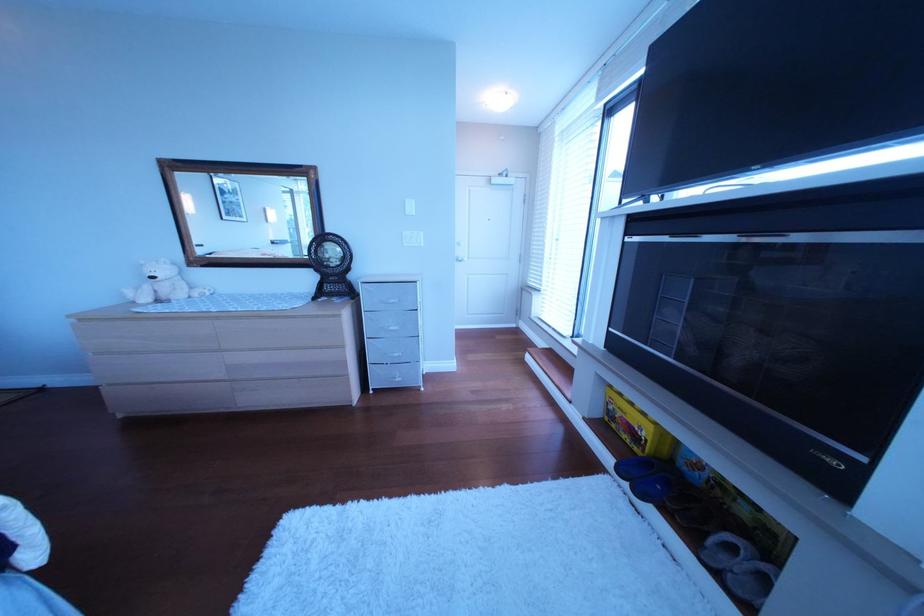
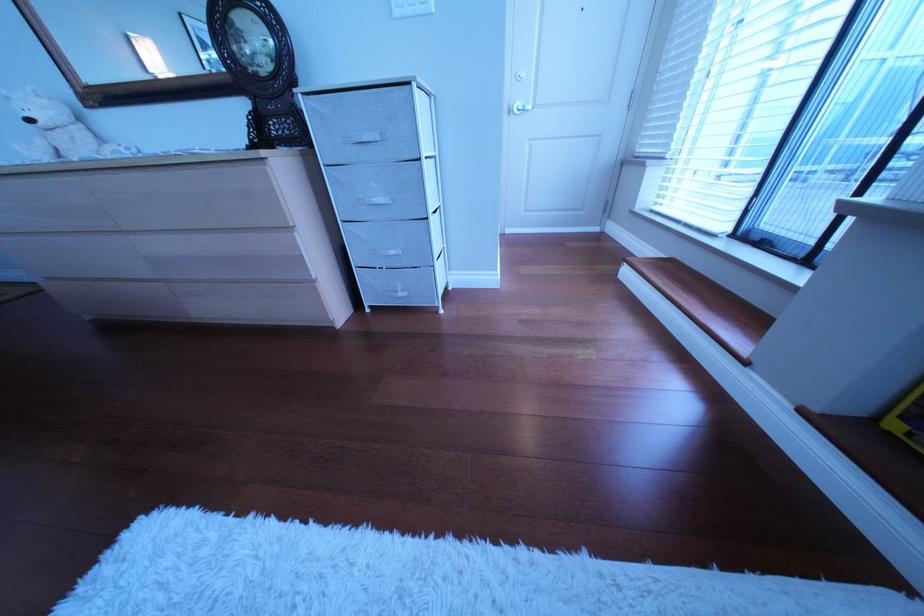
Question: Which direction would the cameraman need to move to produce the second image? Reply with the corresponding letter.

Choices:
 (A) Left
 (B) Right
 (C) Forward
 (D) Backward

Answer: (C)